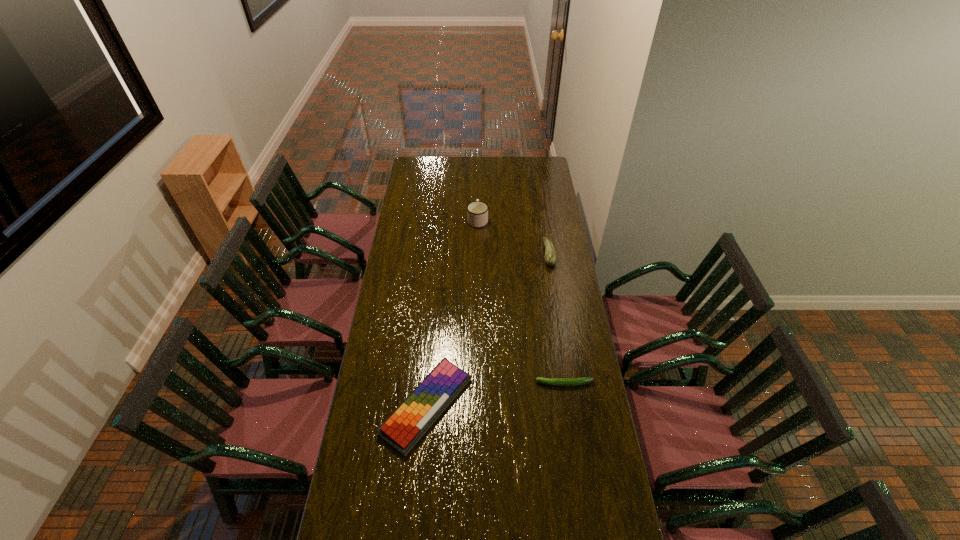
Locate an element on the screen. the tallest object is located at coordinates (477, 212).

Where is `mug`? mug is located at coordinates (477, 212).

The height and width of the screenshot is (540, 960). In order to click on the second farthest object in this screenshot , I will do `click(550, 253)`.

You are a GUI agent. You are given a task and a screenshot of the screen. Output one action in this format:
    pyautogui.click(x=<x>, y=<y>)
    Task: Click on the taller zucchini
    This screenshot has width=960, height=540.
    Given the screenshot: What is the action you would take?
    pyautogui.click(x=550, y=253)

Find the location of a particular element. The width and height of the screenshot is (960, 540). computer keyboard is located at coordinates (407, 424).

Where is `the shorter zucchini`? The width and height of the screenshot is (960, 540). the shorter zucchini is located at coordinates (583, 380).

This screenshot has height=540, width=960. Identify the location of the shortest object. (583, 380).

Identify the location of blank space located 0.360m on the side of the mug with the handle. (478, 176).

This screenshot has width=960, height=540. Identify the location of vacant space positioned on the side of the mug with the handle. (478, 177).

Where is `vacant space located 0.310m on the side of the mug with the handle`? The image size is (960, 540). vacant space located 0.310m on the side of the mug with the handle is located at coordinates (478, 180).